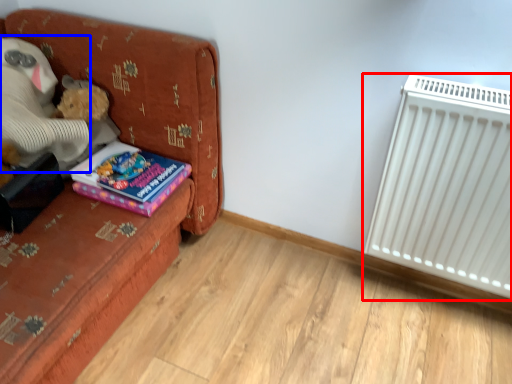
Question: Among these objects, which one is farthest to the camera, radiator (highlighted by a red box) or teddy (highlighted by a blue box)?

Choices:
 (A) radiator
 (B) teddy

Answer: (B)